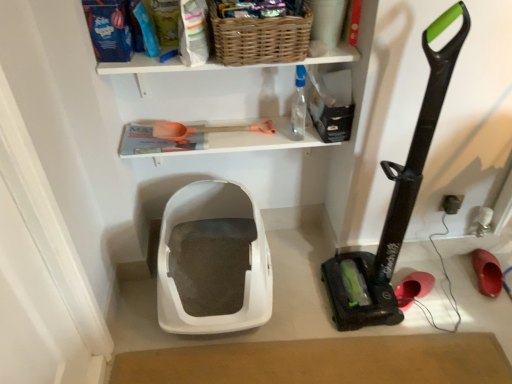
Locate an element on the screen. The height and width of the screenshot is (384, 512). free space behind rubberized red shoe at lower right, the second footwear from the right is located at coordinates (409, 263).